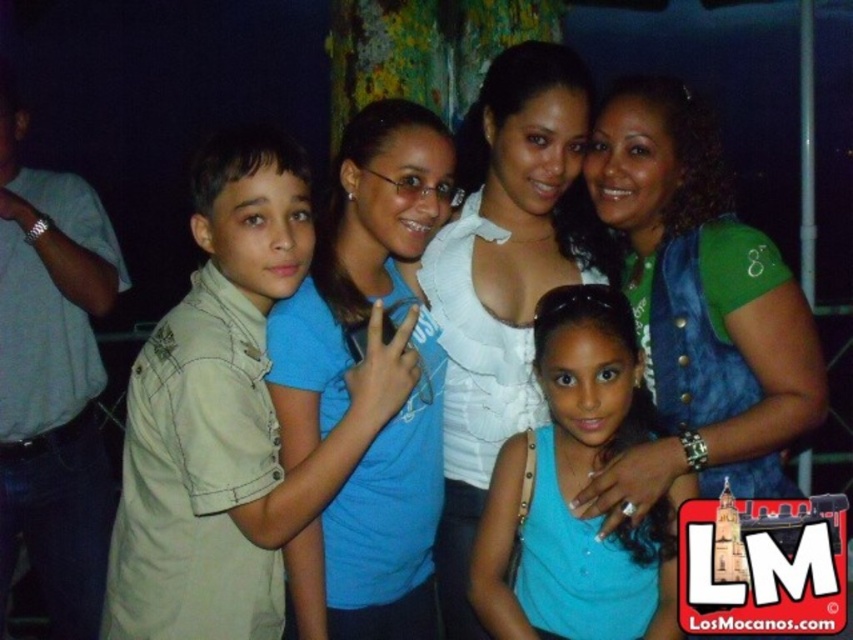
Question: Is white ruffled blouse at center further to the viewer compared to matte blue tank top at center?

Choices:
 (A) yes
 (B) no

Answer: (A)

Question: Is white ruffled blouse at center to the left of matte blue tank top at center from the viewer's perspective?

Choices:
 (A) yes
 (B) no

Answer: (A)

Question: Does blue cotton shirt at center appear over white ruffled blouse at center?

Choices:
 (A) yes
 (B) no

Answer: (B)

Question: Which point is closer to the camera?

Choices:
 (A) (717, 310)
 (B) (476, 600)
 (C) (393, 445)

Answer: (A)

Question: Which of the following is the closest to the observer?

Choices:
 (A) (161, 368)
 (B) (569, 182)
 (C) (550, 476)

Answer: (A)

Question: Which object is positioned farthest from the green denim vest at upper right?

Choices:
 (A) matte blue tank top at center
 (B) white ruffled blouse at center
 (C) beige cotton shirt at left
 (D) blue cotton shirt at center

Answer: (C)